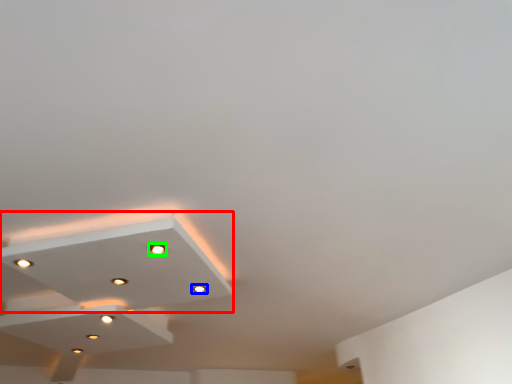
Question: Which object is the closest to the lamp (highlighted by a red box)? Choose among these: light (highlighted by a blue box) or droplight (highlighted by a green box).

Choices:
 (A) light
 (B) droplight

Answer: (B)